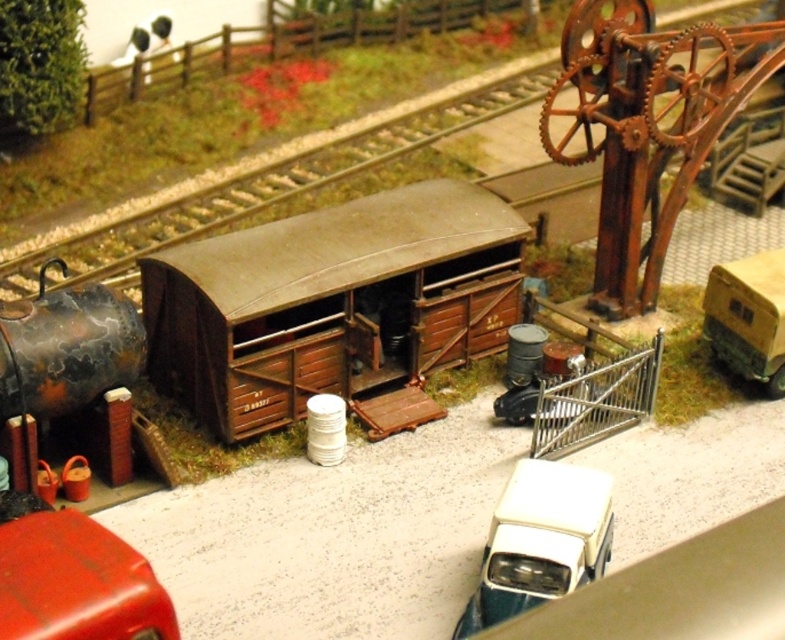
Question: Does white glossy van at lower right have a smaller size compared to matte yellow trailer at right?

Choices:
 (A) yes
 (B) no

Answer: (B)

Question: Observing the image, what is the correct spatial positioning of white glossy van at lower right in reference to matte yellow trailer at right?

Choices:
 (A) above
 (B) below

Answer: (B)

Question: Is the position of white glossy van at lower right more distant than that of matte yellow trailer at right?

Choices:
 (A) no
 (B) yes

Answer: (A)

Question: Which of the following is the farthest from the observer?

Choices:
 (A) (360, 364)
 (B) (747, 371)
 (C) (561, 561)

Answer: (B)

Question: Which of the following is the farthest from the observer?

Choices:
 (A) (559, 563)
 (B) (769, 275)
 (C) (480, 205)

Answer: (C)

Question: Which of these objects is positioned farthest from the brown wooden train car at center?

Choices:
 (A) white glossy van at lower right
 (B) matte yellow trailer at right

Answer: (A)